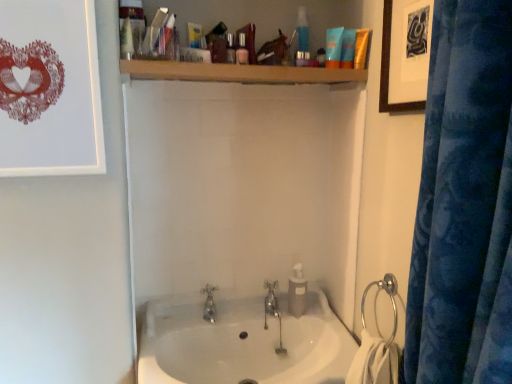
Question: Does wooden shelf at upper center have a lesser width compared to silver metallic tap at center, the second tap from the left?

Choices:
 (A) no
 (B) yes

Answer: (A)

Question: Is wooden shelf at upper center positioned in front of silver metallic tap at center, which is the 1th tap from right to left?

Choices:
 (A) yes
 (B) no

Answer: (A)

Question: Is wooden shelf at upper center outside of silver metallic tap at center, which is the 1th tap from right to left?

Choices:
 (A) no
 (B) yes

Answer: (B)

Question: Is wooden shelf at upper center smaller than silver metallic tap at center, the second tap from the left?

Choices:
 (A) no
 (B) yes

Answer: (A)

Question: Is wooden shelf at upper center bigger than silver metallic tap at center, the second tap from the left?

Choices:
 (A) yes
 (B) no

Answer: (A)

Question: Is silver metallic tap at center, which is the 1th tap from right to left, located within wooden shelf at upper center?

Choices:
 (A) no
 (B) yes

Answer: (A)

Question: Considering the relative positions of blue matte lotion at upper center, the 3th toiletry positioned from the back, and silver metallic towel ring at right in the image provided, is blue matte lotion at upper center, the 3th toiletry positioned from the back, to the left of silver metallic towel ring at right from the viewer's perspective?

Choices:
 (A) no
 (B) yes

Answer: (B)

Question: Is the depth of blue matte lotion at upper center, which is counted as the 3th toiletry, starting from the left, greater than that of silver metallic towel ring at right?

Choices:
 (A) no
 (B) yes

Answer: (B)

Question: Is blue matte lotion at upper center, the 3th toiletry in the right-to-left sequence, outside silver metallic towel ring at right?

Choices:
 (A) yes
 (B) no

Answer: (A)

Question: Is blue matte lotion at upper center, acting as the 3th toiletry starting from the front, far from silver metallic towel ring at right?

Choices:
 (A) yes
 (B) no

Answer: (B)

Question: Considering the relative sizes of blue matte lotion at upper center, positioned as the 4th toiletry in bottom-to-top order, and silver metallic towel ring at right in the image provided, is blue matte lotion at upper center, positioned as the 4th toiletry in bottom-to-top order, smaller than silver metallic towel ring at right?

Choices:
 (A) yes
 (B) no

Answer: (A)

Question: Can you confirm if blue matte lotion at upper center, acting as the 3th toiletry starting from the front, is positioned to the right of silver metallic towel ring at right?

Choices:
 (A) yes
 (B) no

Answer: (B)

Question: Is the position of white glossy sink at center more distant than that of silver metallic towel ring at right?

Choices:
 (A) yes
 (B) no

Answer: (B)